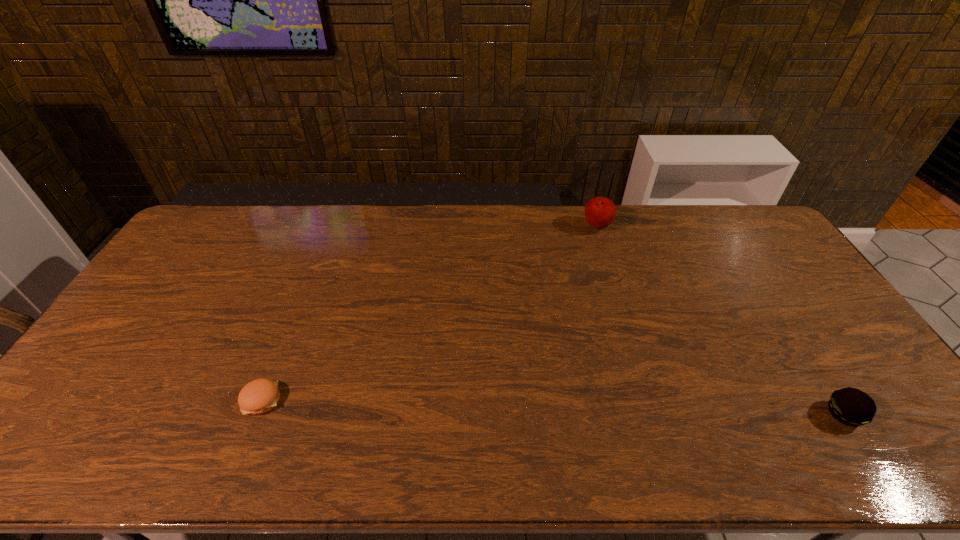
Where is `free space between the apple and the shorter patty`? free space between the apple and the shorter patty is located at coordinates (429, 314).

Find the location of `free space between the rightmost object and the second object from right to left`. free space between the rightmost object and the second object from right to left is located at coordinates (720, 321).

This screenshot has height=540, width=960. I want to click on empty location between the farthest object and the taller patty, so click(x=720, y=321).

The image size is (960, 540). In order to click on free point between the tallest object and the leftmost object in this screenshot , I will do `click(429, 314)`.

The image size is (960, 540). Find the location of `vacant region between the taller patty and the tallest object`. vacant region between the taller patty and the tallest object is located at coordinates (720, 321).

Locate an element on the screen. This screenshot has height=540, width=960. empty location between the left patty and the second object from left to right is located at coordinates (429, 314).

Select which object is the closest to the second tallest object. Please provide its 2D coordinates. Your answer should be formatted as a tuple, i.e. [(x, y)], where the tuple contains the x and y coordinates of a point satisfying the conditions above.

[(600, 212)]

Point out which object is positioned as the second nearest to the farthest object. Please provide its 2D coordinates. Your answer should be formatted as a tuple, i.e. [(x, y)], where the tuple contains the x and y coordinates of a point satisfying the conditions above.

[(259, 396)]

Locate an element on the screen. This screenshot has width=960, height=540. blank space that satisfies the following two spatial constraints: 1. on the front side of the taller patty; 2. on the left side of the apple is located at coordinates (656, 414).